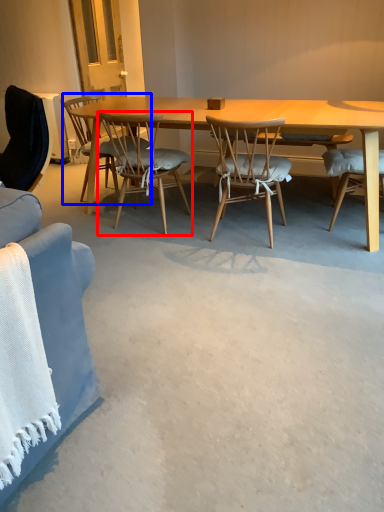
Question: Which of the following is the closest to the observer, chair (highlighted by a red box) or chair (highlighted by a blue box)?

Choices:
 (A) chair
 (B) chair

Answer: (A)